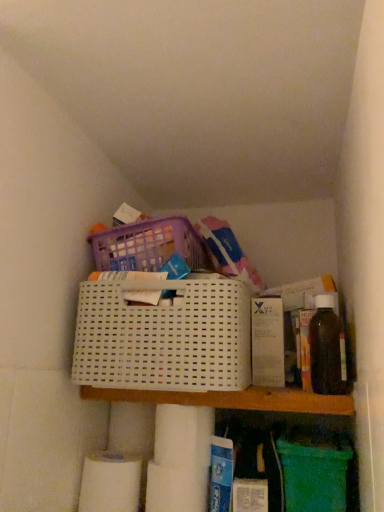
The height and width of the screenshot is (512, 384). What are the coordinates of `translucent amber bottle at right` in the screenshot? It's located at (327, 349).

Image resolution: width=384 pixels, height=512 pixels. In order to click on white matte toilet paper at lower center, which ranks as the second toilet paper in left-to-right order in this screenshot , I will do `click(180, 459)`.

Locate an element on the screen. translucent amber bottle at right is located at coordinates [327, 349].

From a real-world perspective, does white plastic shelf at center sit lower than white matte toilet paper at lower center, which ranks as the second toilet paper in left-to-right order?

Actually, white plastic shelf at center is physically above white matte toilet paper at lower center, which ranks as the second toilet paper in left-to-right order, in the real world.

Which is closer, (134, 396) or (207, 464)?

The point (134, 396) is more forward.

Would you say white plastic shelf at center is inside or outside white matte toilet paper at lower center, which ranks as the second toilet paper in left-to-right order?

white plastic shelf at center lies outside white matte toilet paper at lower center, which ranks as the second toilet paper in left-to-right order.

Does white matte toilet paper at lower left, the 2th toilet paper in the top-to-bottom sequence, touch translucent amber bottle at right?

There is a gap between white matte toilet paper at lower left, the 2th toilet paper in the top-to-bottom sequence, and translucent amber bottle at right.

From the picture: From their relative heights in the image, would you say white matte toilet paper at lower left, which appears as the 2th toilet paper when viewed from the right, is taller or shorter than translucent amber bottle at right?

white matte toilet paper at lower left, which appears as the 2th toilet paper when viewed from the right, is shorter than translucent amber bottle at right.

How many degrees apart are the facing directions of white matte toilet paper at lower left, the 1th toilet paper ordered from the bottom, and translucent amber bottle at right?

white matte toilet paper at lower left, the 1th toilet paper ordered from the bottom, and translucent amber bottle at right are facing 0.00072 degrees away from each other.

In the scene shown: From a real-world perspective, relative to translucent amber bottle at right, is white matte toilet paper at lower left, the 1th toilet paper ordered from the bottom, vertically above or below?

white matte toilet paper at lower left, the 1th toilet paper ordered from the bottom, is below translucent amber bottle at right.

Based on the photo, is white matte toilet paper at lower center, the second toilet paper ordered from the bottom, in front of or behind white matte toilet paper at lower left, the 1th toilet paper ordered from the bottom, in the image?

white matte toilet paper at lower center, the second toilet paper ordered from the bottom, is in front of white matte toilet paper at lower left, the 1th toilet paper ordered from the bottom.

Which is nearer, (172, 484) or (104, 467)?

The point (172, 484) is in front.

Does white matte toilet paper at lower center, which appears as the 1th toilet paper when viewed from the top, have a smaller size compared to white matte toilet paper at lower left, which appears as the 2th toilet paper when viewed from the right?

Yes, white matte toilet paper at lower center, which appears as the 1th toilet paper when viewed from the top, is smaller than white matte toilet paper at lower left, which appears as the 2th toilet paper when viewed from the right.

Identify the location of toilet paper below the white matte toilet paper at lower center, the second toilet paper ordered from the bottom (from a real-world perspective). (110, 482).

Which of these two, white matte toilet paper at lower center, which ranks as the second toilet paper in left-to-right order, or white plastic basket at center, stands shorter?

white matte toilet paper at lower center, which ranks as the second toilet paper in left-to-right order.

Looking at their sizes, would you say white matte toilet paper at lower center, the second toilet paper ordered from the bottom, is wider or thinner than white plastic basket at center?

Clearly, white matte toilet paper at lower center, the second toilet paper ordered from the bottom, has less width compared to white plastic basket at center.

Is white matte toilet paper at lower center, which ranks as the second toilet paper in left-to-right order, smaller than white plastic basket at center?

Yes, white matte toilet paper at lower center, which ranks as the second toilet paper in left-to-right order, is smaller than white plastic basket at center.

From a real-world perspective, relative to white plastic basket at center, is white matte toilet paper at lower center, which appears as the 1th toilet paper when viewed from the top, vertically above or below?

white matte toilet paper at lower center, which appears as the 1th toilet paper when viewed from the top, is situated lower than white plastic basket at center in the real world.

Between white matte toilet paper at lower left, the 1th toilet paper ordered from the bottom, and white plastic basket at center, which one appears on the right side from the viewer's perspective?

white plastic basket at center is more to the right.

Can you confirm if white matte toilet paper at lower left, the 2th toilet paper in the top-to-bottom sequence, is thinner than white plastic basket at center?

Yes.

From a real-world perspective, who is located lower, white matte toilet paper at lower left, the 1th toilet paper ordered from the bottom, or white plastic basket at center?

In real-world perspective, white matte toilet paper at lower left, the 1th toilet paper ordered from the bottom, is lower.

Is the surface of translucent amber bottle at right in direct contact with white plastic shelf at center?

No, translucent amber bottle at right is not making contact with white plastic shelf at center.

Is translucent amber bottle at right inside or outside of white plastic shelf at center?

translucent amber bottle at right is located beyond the bounds of white plastic shelf at center.

Which object is further away from the camera taking this photo, translucent amber bottle at right or white plastic shelf at center?

translucent amber bottle at right is more distant.

Between white plastic basket at center and translucent amber bottle at right, which one has larger width?

With larger width is white plastic basket at center.

Does white plastic basket at center appear on the left side of translucent amber bottle at right?

Correct, you'll find white plastic basket at center to the left of translucent amber bottle at right.

Considering the relative sizes of white plastic basket at center and translucent amber bottle at right in the image provided, is white plastic basket at center bigger than translucent amber bottle at right?

Yes.

Which is correct: white plastic basket at center is inside translucent amber bottle at right, or outside of it?

white plastic basket at center exists outside the volume of translucent amber bottle at right.

From a real-world perspective, which toilet paper is the 1st one underneath the white plastic shelf at center? Please provide its 2D coordinates.

[(180, 459)]

Starting from the translucent amber bottle at right, which toilet paper is the 2nd one behind? Please provide its 2D coordinates.

[(110, 482)]

When comparing their distances from white plastic basket at center, does white matte toilet paper at lower center, which appears as the 1th toilet paper when viewed from the top, or translucent amber bottle at right seem further?

The object further to white plastic basket at center is translucent amber bottle at right.

Considering their positions, is white plastic basket at center positioned closer to white plastic shelf at center than white matte toilet paper at lower center, which ranks as the second toilet paper in left-to-right order?

Based on the image, white plastic basket at center appears to be nearer to white plastic shelf at center.

Based on their spatial positions, is white plastic basket at center or white matte toilet paper at lower left, which appears as the 2th toilet paper when viewed from the right, further from white plastic shelf at center?

white matte toilet paper at lower left, which appears as the 2th toilet paper when viewed from the right.

Looking at the image, which one is located further to white plastic basket at center, translucent amber bottle at right or white matte toilet paper at lower left, which appears as the 2th toilet paper when viewed from the right?

white matte toilet paper at lower left, which appears as the 2th toilet paper when viewed from the right, lies further to white plastic basket at center than the other object.

Considering their positions, is white plastic shelf at center positioned closer to white matte toilet paper at lower center, placed as the first toilet paper when sorted from right to left, than white matte toilet paper at lower left, the 2th toilet paper in the top-to-bottom sequence?

white matte toilet paper at lower left, the 2th toilet paper in the top-to-bottom sequence.

Looking at the image, which one is located closer to white matte toilet paper at lower left, the 1th toilet paper ordered from the bottom, white plastic basket at center or white matte toilet paper at lower center, which appears as the 1th toilet paper when viewed from the top?

white matte toilet paper at lower center, which appears as the 1th toilet paper when viewed from the top, is positioned closer to the anchor white matte toilet paper at lower left, the 1th toilet paper ordered from the bottom.

Which object lies further to the anchor point white matte toilet paper at lower center, the second toilet paper ordered from the bottom, translucent amber bottle at right or white matte toilet paper at lower left, placed as the 1th toilet paper when sorted from left to right?

translucent amber bottle at right.

Which object lies further to the anchor point translucent amber bottle at right, white plastic shelf at center or white plastic basket at center?

Among the two, white plastic basket at center is located further to translucent amber bottle at right.

At what (x,y) coordinates should I click in order to perform the action: click on toilet paper between white plastic basket at center and white matte toilet paper at lower left, the 2th toilet paper in the top-to-bottom sequence, from top to bottom. Please return your answer as a coordinate pair (x, y). Looking at the image, I should click on (180, 459).

Find the location of `shelf between white plastic basket at center and white matte toilet paper at lower left, the 2th toilet paper in the top-to-bottom sequence, in the up-down direction`. shelf between white plastic basket at center and white matte toilet paper at lower left, the 2th toilet paper in the top-to-bottom sequence, in the up-down direction is located at coordinates (235, 399).

At what (x,y) coordinates should I click in order to perform the action: click on basket between white matte toilet paper at lower left, the 2th toilet paper in the top-to-bottom sequence, and translucent amber bottle at right, in the horizontal direction. Please return your answer as a coordinate pair (x, y). This screenshot has width=384, height=512. Looking at the image, I should click on (164, 335).

I want to click on shelf between white matte toilet paper at lower left, the 2th toilet paper in the top-to-bottom sequence, and translucent amber bottle at right from left to right, so click(x=235, y=399).